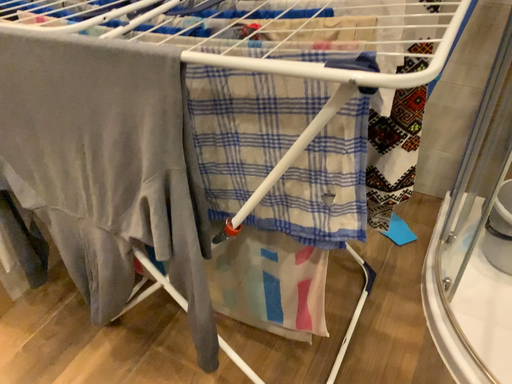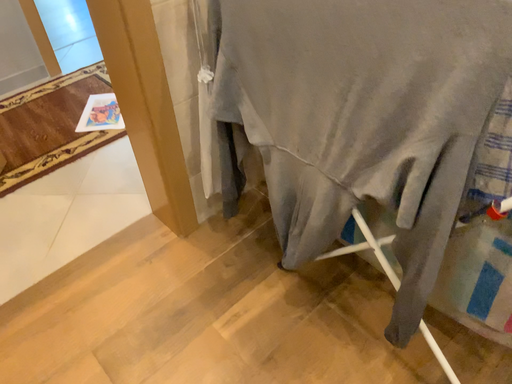
Question: Which way did the camera rotate in the video?

Choices:
 (A) rotated right
 (B) rotated left

Answer: (B)